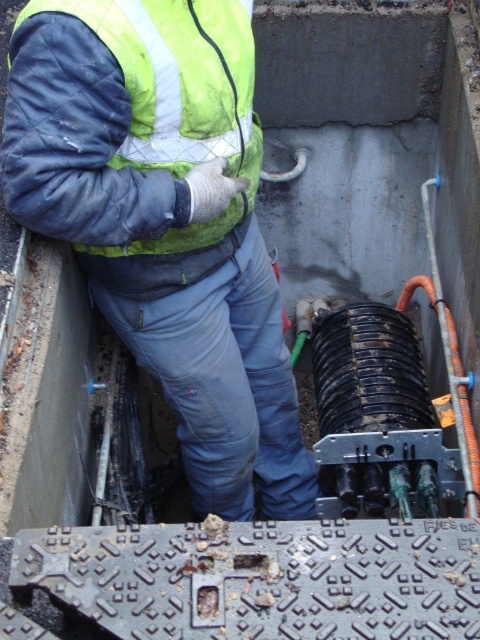
Question: Which object is closer to the camera taking this photo?

Choices:
 (A) reflective yellow-green vest at center
 (B) reflective quilted jacket at upper left

Answer: (B)

Question: Is reflective yellow-green vest at center bigger than reflective quilted jacket at upper left?

Choices:
 (A) no
 (B) yes

Answer: (B)

Question: Is reflective yellow-green vest at center positioned before reflective quilted jacket at upper left?

Choices:
 (A) no
 (B) yes

Answer: (A)

Question: Can you confirm if reflective yellow-green vest at center is thinner than reflective quilted jacket at upper left?

Choices:
 (A) no
 (B) yes

Answer: (A)